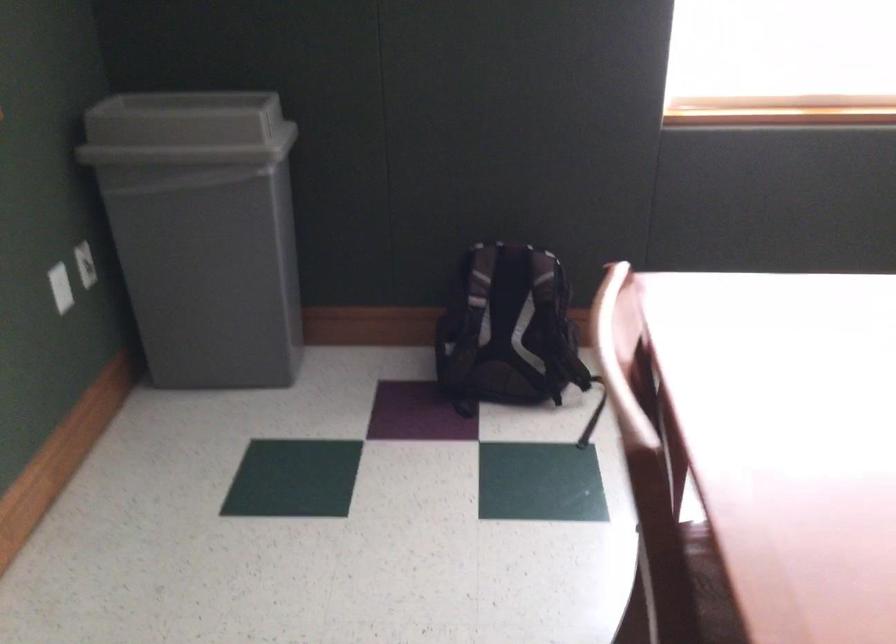
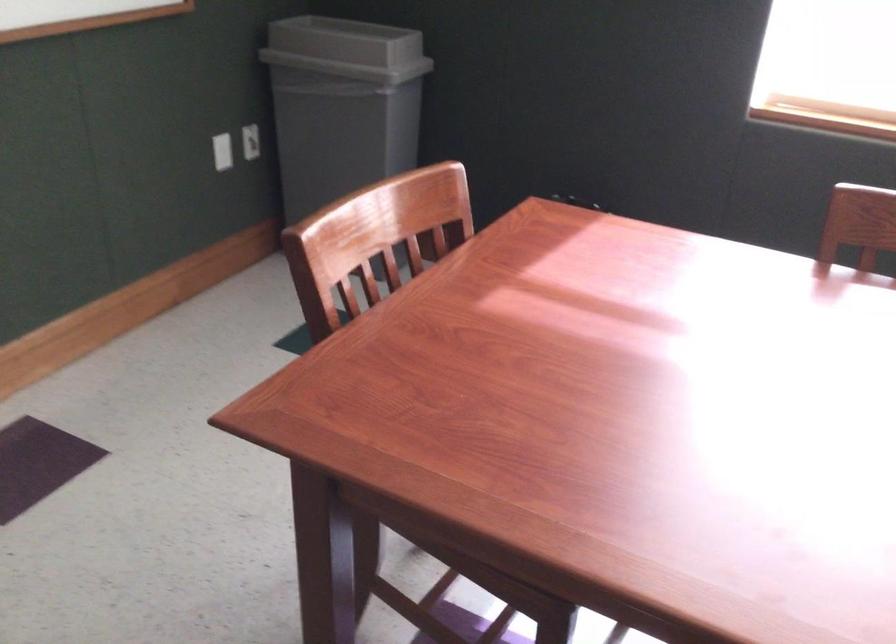
Locate, in the second image, the point that corresponds to (209,127) in the first image.

(346, 49)